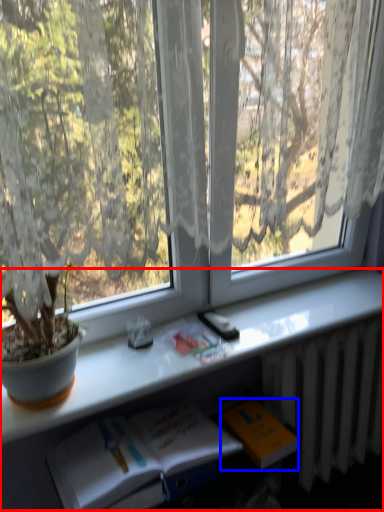
Question: Which object appears closest to the camera in this image, computer desk (highlighted by a red box) or paperback book (highlighted by a blue box)?

Choices:
 (A) computer desk
 (B) paperback book

Answer: (A)